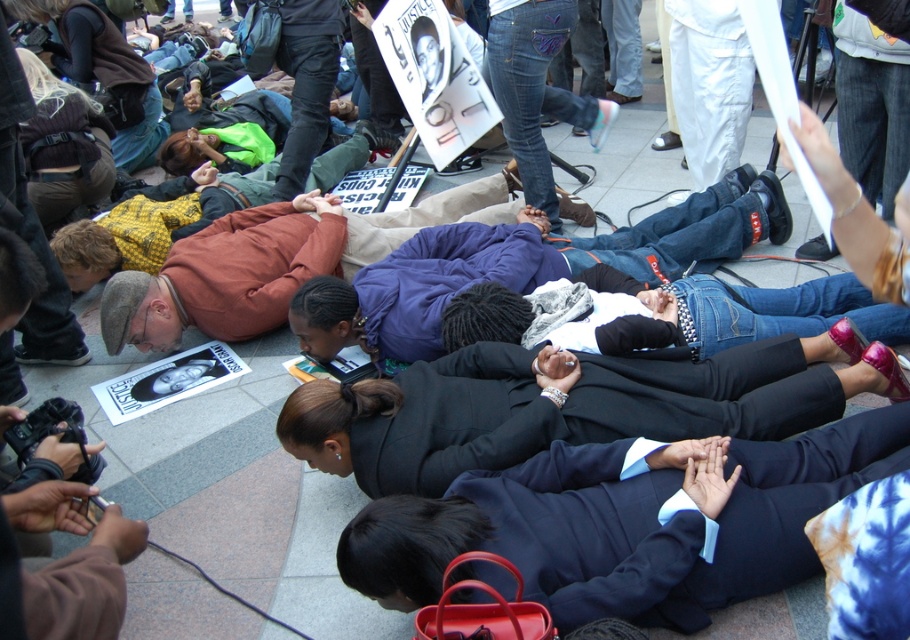
You are organizing a protest and need to arrange two participants, the black suit at center and the denim jacket at center, side by side on a platform. Based on their sizes, which participant should be placed on the left to ensure they both fit within the platform without overlapping?

The black suit at center has a smaller width than the denim jacket at center. To fit both without overlapping, place the black suit at center on the left and the denim jacket at center on the right, ensuring there is enough space between them.